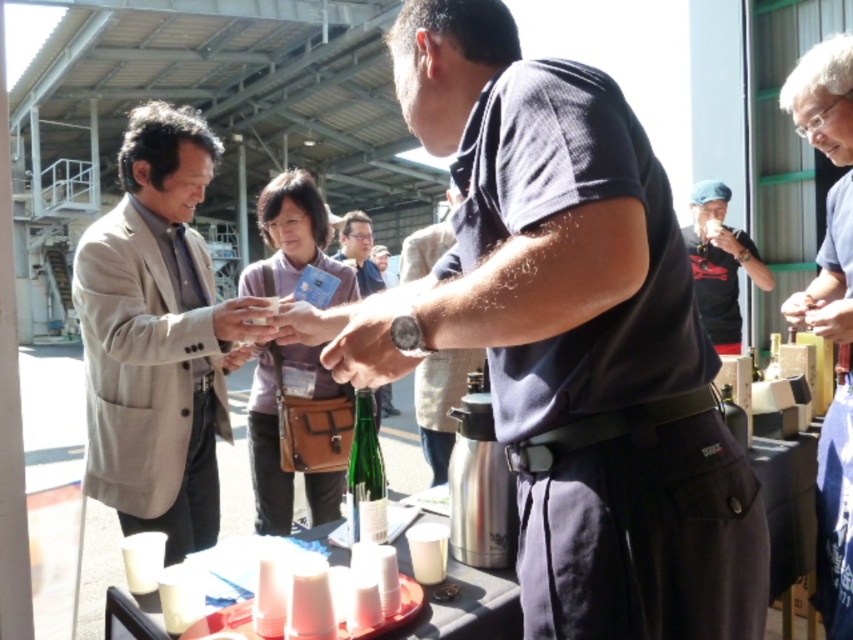
Question: From the image, what is the correct spatial relationship of dark gray t-shirt at center in relation to light beige suit at left?

Choices:
 (A) left
 (B) right

Answer: (B)

Question: Which point is closer to the camera?

Choices:
 (A) black matte shirt at upper right
 (B) dark gray t-shirt at center

Answer: (B)

Question: Does dark gray t-shirt at center appear on the left side of green glass bottle at center?

Choices:
 (A) no
 (B) yes

Answer: (A)

Question: Considering the real-world distances, which object is farthest from the black matte shirt at upper right?

Choices:
 (A) matte black shirt at center
 (B) green glass bottle at center
 (C) dark gray t-shirt at center

Answer: (C)

Question: Which point is closer to the camera taking this photo?

Choices:
 (A) (428, 410)
 (B) (358, 438)
 (C) (378, 394)
 (D) (113, 424)

Answer: (B)

Question: From the image, what is the correct spatial relationship of light beige suit at left in relation to matte black bottle at center?

Choices:
 (A) above
 (B) below

Answer: (A)